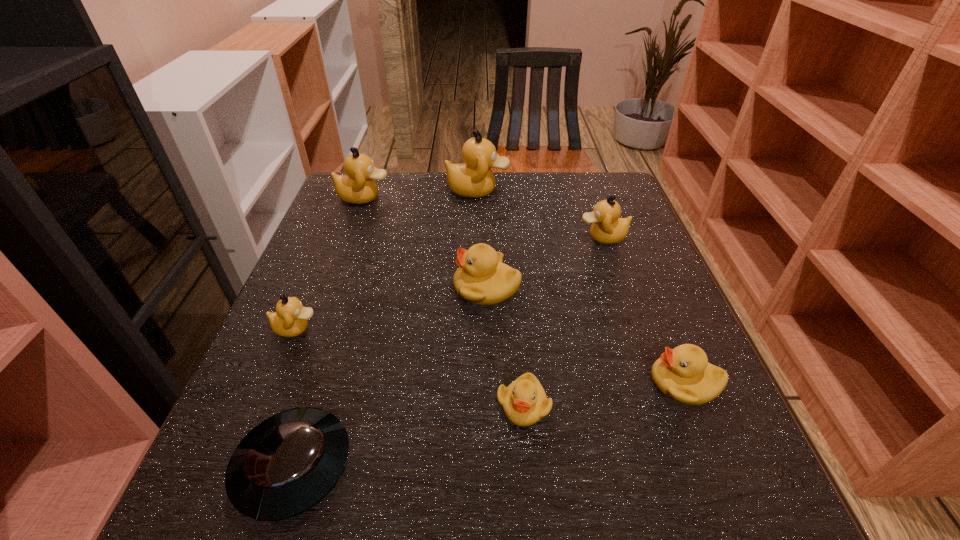
Find the location of a particular element. The width and height of the screenshot is (960, 540). the second smallest yellow duckling is located at coordinates (683, 374).

Locate an element on the screen. This screenshot has width=960, height=540. the smallest yellow duckling is located at coordinates (524, 401).

Where is `saucer`? Image resolution: width=960 pixels, height=540 pixels. saucer is located at coordinates (288, 463).

Find the location of `blank space located 0.220m on the face of the biggest tan duckling`. blank space located 0.220m on the face of the biggest tan duckling is located at coordinates (586, 190).

Find the location of a particular element. The height and width of the screenshot is (540, 960). blank space located 0.390m on the face of the second tallest object is located at coordinates (530, 198).

Locate an element on the screen. The image size is (960, 540). vacant space situated 0.140m on the face of the third farthest duckling is located at coordinates (522, 237).

Locate an element on the screen. The image size is (960, 540). vacant space located on the face of the third farthest duckling is located at coordinates (474, 237).

Where is `free space located 0.320m on the face of the third farthest duckling`? The width and height of the screenshot is (960, 540). free space located 0.320m on the face of the third farthest duckling is located at coordinates (449, 237).

You are a GUI agent. You are given a task and a screenshot of the screen. Output one action in this format:
    pyautogui.click(x=<x>, y=<y>)
    Task: Click on the free space located at the face of the fifth nearest object
    
    Given the screenshot: What is the action you would take?
    pyautogui.click(x=430, y=288)

This screenshot has height=540, width=960. I want to click on free location located 0.130m at the face of the fifth nearest object, so click(394, 288).